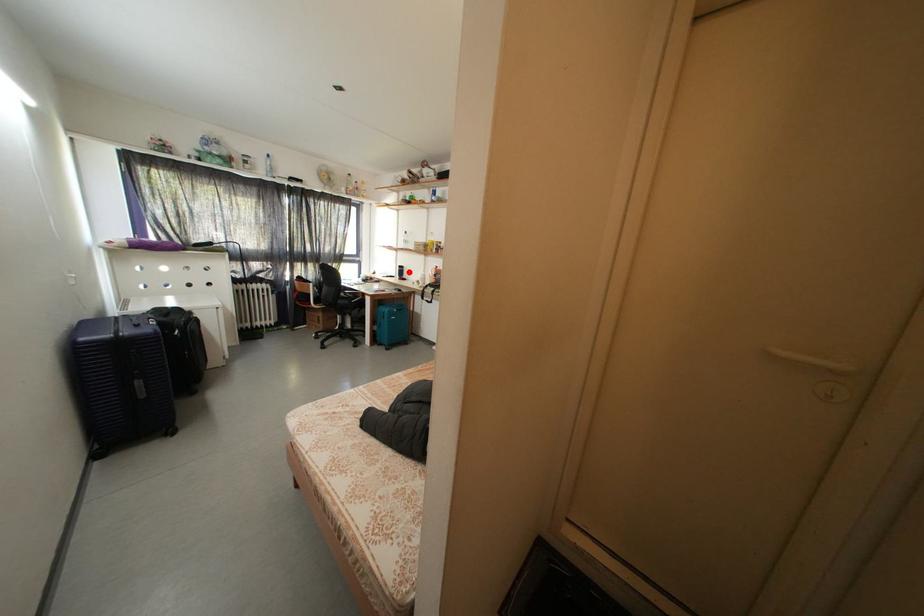
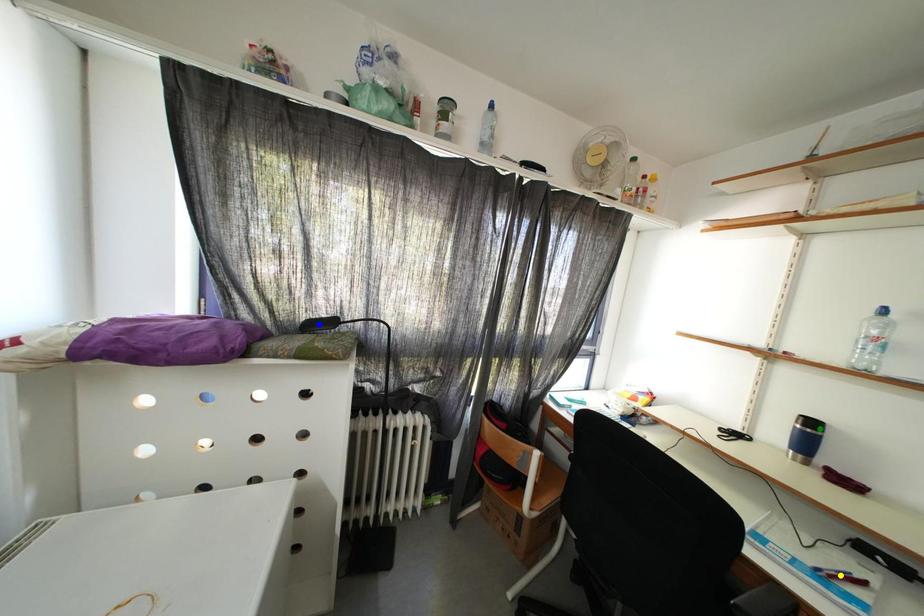
Question: I am providing you with two images of the same scene from different viewpoints. A red point is marked on the first image. You are given multiple points on the second image. Which point in image 2 is actually the same real-world point as the red point in image 1?

Choices:
 (A) blue point
 (B) yellow point
 (C) green point

Answer: (C)